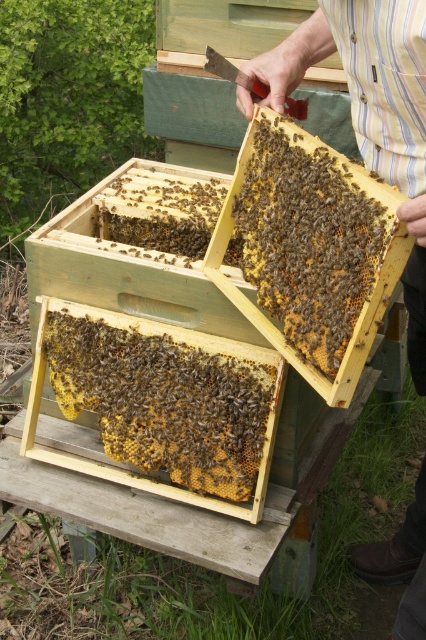
You are a beekeeper inspecting the hive. You notice the beehive at center and the brown wax comb at center. Which object is closer to your face?

The beehive at center is closer to the viewer than the brown wax comb at center, so the beehive at center is closer to your face.